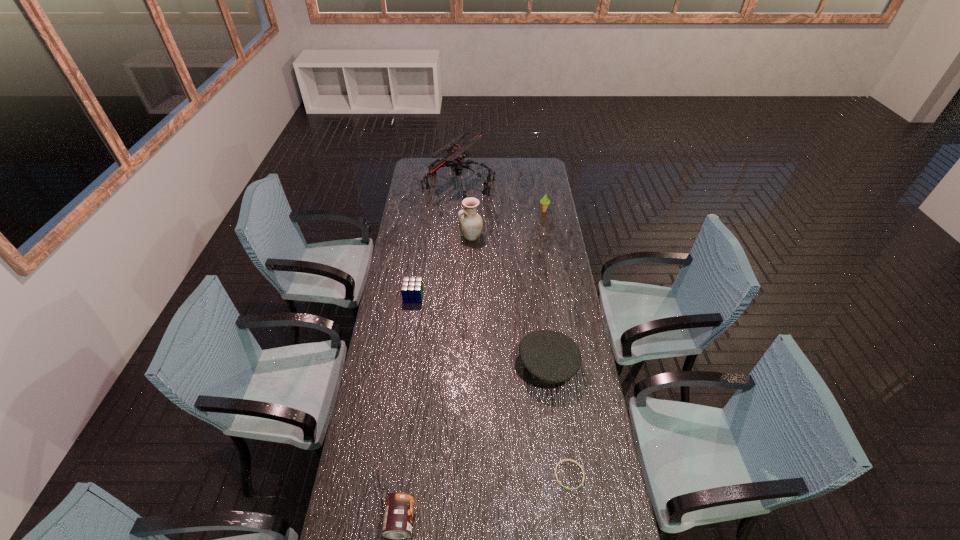
Where is `drone that is at the left edge`? This screenshot has width=960, height=540. drone that is at the left edge is located at coordinates (457, 153).

Identify the location of cube at the left edge. This screenshot has height=540, width=960. (412, 289).

The height and width of the screenshot is (540, 960). In order to click on can that is at the left edge in this screenshot , I will do `click(398, 517)`.

Locate an element on the screen. This screenshot has width=960, height=540. icecream present at the right edge is located at coordinates (544, 201).

Locate an element on the screen. The height and width of the screenshot is (540, 960). beret that is at the right edge is located at coordinates (545, 357).

This screenshot has width=960, height=540. What are the coordinates of `bracelet present at the right edge` in the screenshot? It's located at (557, 480).

I want to click on object that is positioned at the far left corner, so click(x=457, y=153).

Identify the location of vacant space at the left edge of the desktop. (358, 441).

Where is `vacant space at the right edge of the desktop`? The width and height of the screenshot is (960, 540). vacant space at the right edge of the desktop is located at coordinates (557, 222).

Where is `free space at the far left corner of the desktop`? The width and height of the screenshot is (960, 540). free space at the far left corner of the desktop is located at coordinates (420, 170).